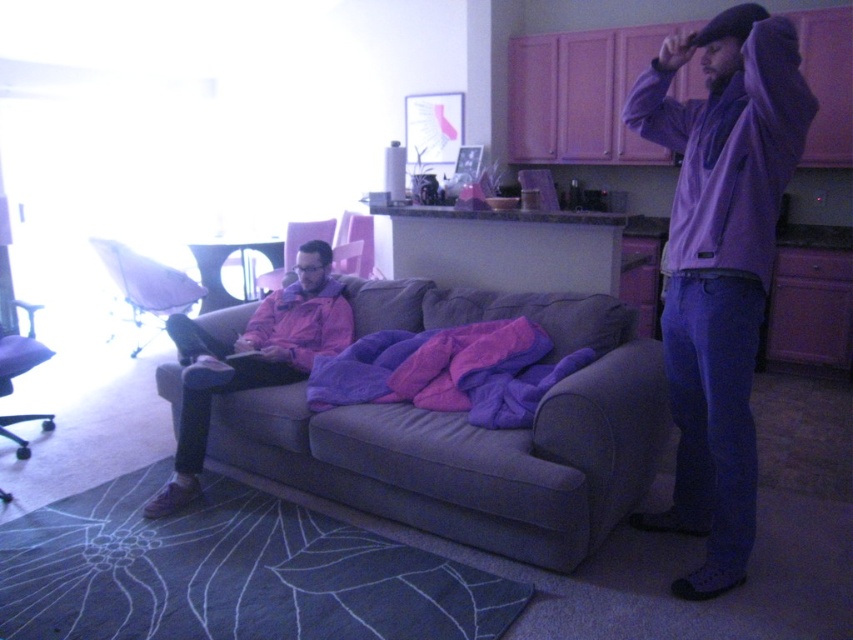
Does velvet purple couch at center have a larger size compared to pink fabric armchair at center?

Correct, velvet purple couch at center is larger in size than pink fabric armchair at center.

How far apart are velvet purple couch at center and pink fabric armchair at center?

The distance of velvet purple couch at center from pink fabric armchair at center is 2.32 meters.

Identify the location of velvet purple couch at center. This screenshot has width=853, height=640. (474, 433).

Which is in front, point (125, 268) or point (9, 348)?

Point (9, 348) is in front.

Between metallic silver swivel chair at left and matte purple swivel chair at left, which one appears on the left side from the viewer's perspective?

matte purple swivel chair at left

Find the location of a particular element. metallic silver swivel chair at left is located at coordinates (146, 278).

Can you confirm if pink matte jacket at center is smaller than metallic silver swivel chair at left?

Actually, pink matte jacket at center might be larger than metallic silver swivel chair at left.

Does pink matte jacket at center have a lesser height compared to metallic silver swivel chair at left?

In fact, pink matte jacket at center may be taller than metallic silver swivel chair at left.

Identify the location of pink matte jacket at center. (252, 358).

Where is `pink matte jacket at center`? The width and height of the screenshot is (853, 640). pink matte jacket at center is located at coordinates (252, 358).